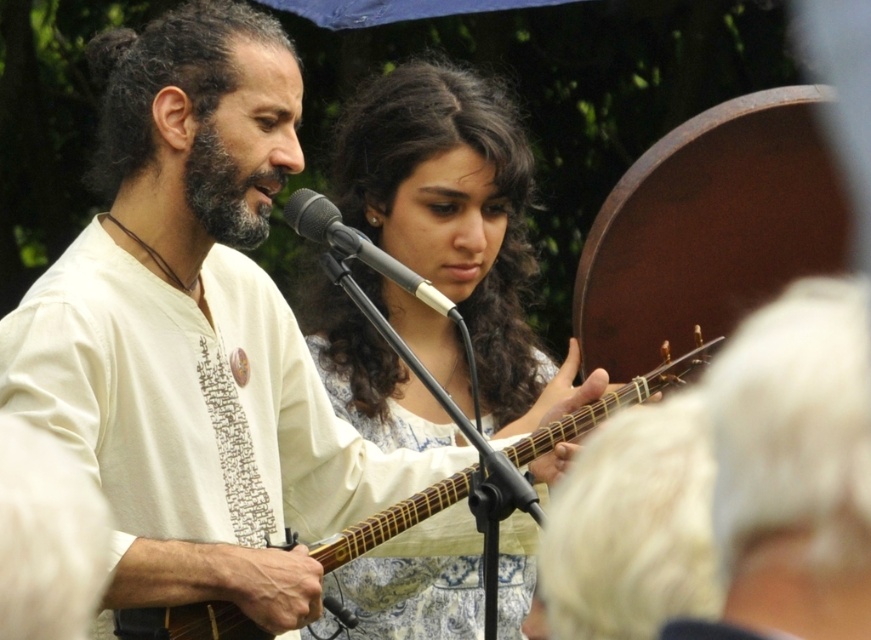
You are a photographer trying to capture the best angle of the two musicians. You notice two points of interest marked as point 1 at coordinates point (412,518) and point 2 at coordinates point (355,236). Which point is closer to your camera lens?

Point 1 at coordinates point (412,518) is closer to the camera lens because it is further to the viewer than point 2 at coordinates point (355,236).

You are a photographer setting up for a concert photo shoot. You need to position a light source to the left of the wooden acoustic guitar at center and another light to the right of the black matte microphone at center. Will the two light sources be placed in the same position?

The wooden acoustic guitar at center is to the right of the black matte microphone at center. Therefore, placing a light to the left of the wooden acoustic guitar at center and another to the right of the black matte microphone at center would result in different positions. The first light would be to the left of the guitar, which is already right of the microphone, and the second light would be to the right of the microphone. Thus, the two light sources will not be in the same position.